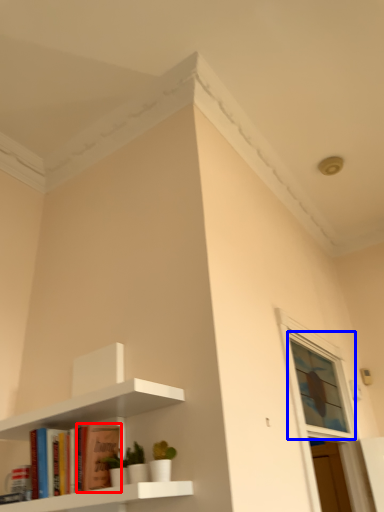
Question: Which object is further to the camera taking this photo, book (highlighted by a red box) or window (highlighted by a blue box)?

Choices:
 (A) book
 (B) window

Answer: (B)